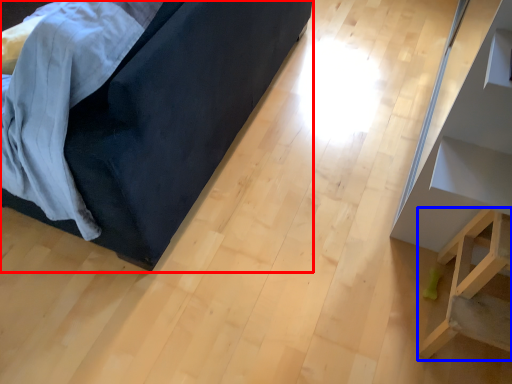
Question: Among these objects, which one is farthest to the camera, furniture (highlighted by a red box) or furniture (highlighted by a blue box)?

Choices:
 (A) furniture
 (B) furniture

Answer: (B)